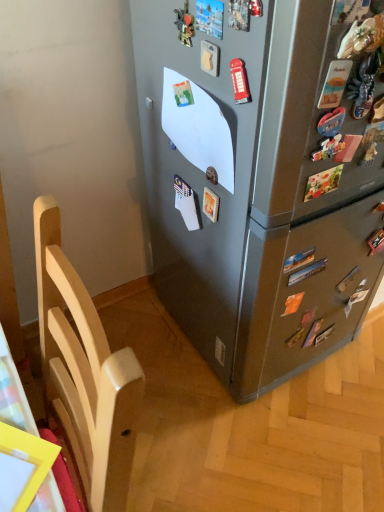
Identify the location of satin gray refrigerator at center. This screenshot has height=512, width=384. (263, 175).

Image resolution: width=384 pixels, height=512 pixels. Describe the element at coordinates (263, 175) in the screenshot. I see `satin gray refrigerator at center` at that location.

Locate an element on the screen. This screenshot has height=512, width=384. light wood chair at left is located at coordinates (85, 373).

Describe the element at coordinates (85, 373) in the screenshot. I see `light wood chair at left` at that location.

Where is `satin gray refrigerator at center`? The width and height of the screenshot is (384, 512). satin gray refrigerator at center is located at coordinates (263, 175).

Does light wood chair at left appear on the right side of satin gray refrigerator at center?

No.

Considering the relative positions of light wood chair at left and satin gray refrigerator at center in the image provided, is light wood chair at left behind satin gray refrigerator at center?

No, light wood chair at left is in front of satin gray refrigerator at center.

Which is closer to the camera, (83, 362) or (187, 268)?

Point (83, 362)

From the image's perspective, between light wood chair at left and satin gray refrigerator at center, who is located below?

light wood chair at left is shown below in the image.

From a real-world perspective, which object stands above the other?

From a 3D spatial view, satin gray refrigerator at center is above.

Based on the photo, considering the sizes of objects light wood chair at left and satin gray refrigerator at center in the image provided, who is thinner, light wood chair at left or satin gray refrigerator at center?

light wood chair at left is thinner.

Can you confirm if light wood chair at left is shorter than satin gray refrigerator at center?

Indeed, light wood chair at left has a lesser height compared to satin gray refrigerator at center.

From the picture: Considering the relative sizes of light wood chair at left and satin gray refrigerator at center in the image provided, is light wood chair at left smaller than satin gray refrigerator at center?

Indeed, light wood chair at left has a smaller size compared to satin gray refrigerator at center.

Is light wood chair at left surrounding satin gray refrigerator at center?

No, light wood chair at left does not contain satin gray refrigerator at center.

Is light wood chair at left beside satin gray refrigerator at center?

light wood chair at left and satin gray refrigerator at center are not in contact.

Is light wood chair at left looking in the opposite direction of satin gray refrigerator at center?

No, light wood chair at left is not facing the opposite direction of satin gray refrigerator at center.

Where is `furniture lying on the left of satin gray refrigerator at center`? The image size is (384, 512). furniture lying on the left of satin gray refrigerator at center is located at coordinates (85, 373).

Considering the positions of objects satin gray refrigerator at center and light wood chair at left in the image provided, who is more to the left, satin gray refrigerator at center or light wood chair at left?

light wood chair at left.

Which object is more forward, satin gray refrigerator at center or light wood chair at left?

light wood chair at left is more forward.

Considering the positions of points (307, 236) and (116, 450), is point (307, 236) closer to camera compared to point (116, 450)?

No, it is not.

From the image's perspective, does satin gray refrigerator at center appear lower than light wood chair at left?

No, from the image's perspective, satin gray refrigerator at center is not beneath light wood chair at left.

From a real-world perspective, which is physically below, satin gray refrigerator at center or light wood chair at left?

In real-world perspective, light wood chair at left is lower.

Between satin gray refrigerator at center and light wood chair at left, which one has larger width?

Wider between the two is satin gray refrigerator at center.

Is satin gray refrigerator at center taller than light wood chair at left?

Indeed, satin gray refrigerator at center has a greater height compared to light wood chair at left.

In terms of size, does satin gray refrigerator at center appear bigger or smaller than light wood chair at left?

In the image, satin gray refrigerator at center appears to be larger than light wood chair at left.

Is satin gray refrigerator at center positioned beyond the bounds of light wood chair at left?

satin gray refrigerator at center is positioned outside light wood chair at left.

Is satin gray refrigerator at center next to light wood chair at left?

No, satin gray refrigerator at center is not in contact with light wood chair at left.

Could you tell me if satin gray refrigerator at center is facing light wood chair at left?

No, satin gray refrigerator at center is not turned towards light wood chair at left.

How different are the orientations of satin gray refrigerator at center and light wood chair at left in degrees?

satin gray refrigerator at center and light wood chair at left are facing 93 degrees away from each other.

Measure the distance from satin gray refrigerator at center to light wood chair at left.

They are 23.33 inches apart.

This screenshot has height=512, width=384. What are the coordinates of `refrigerator behind the light wood chair at left` in the screenshot? It's located at click(263, 175).

Identify the location of refrigerator that appears behind the light wood chair at left. The height and width of the screenshot is (512, 384). (263, 175).

This screenshot has height=512, width=384. Identify the location of furniture lying on the left of satin gray refrigerator at center. (85, 373).